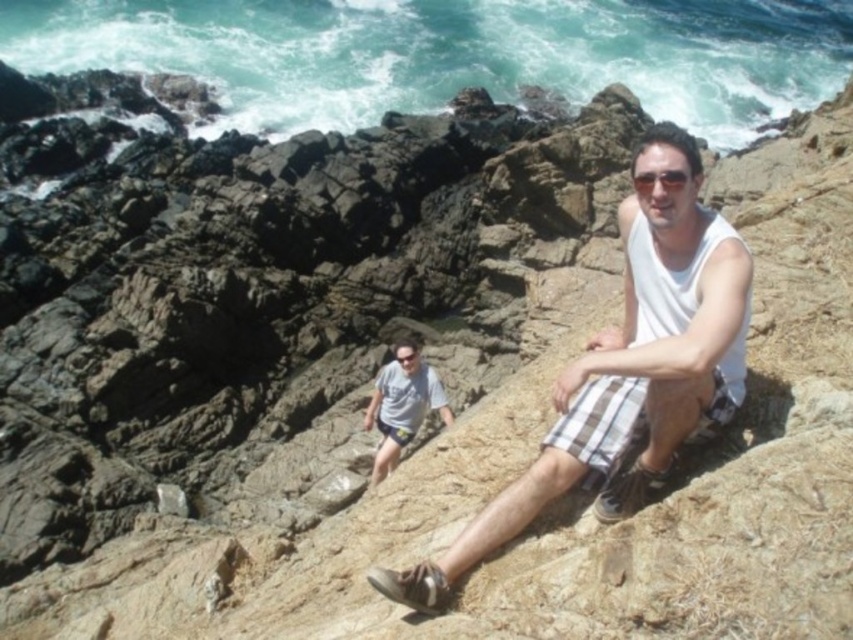
Which of these two, white cotton tank top at center or white cotton shirt at center, stands taller?

With more height is white cotton tank top at center.

This screenshot has height=640, width=853. Describe the element at coordinates (628, 369) in the screenshot. I see `white cotton tank top at center` at that location.

Who is more distant from viewer, (x=518, y=512) or (x=405, y=372)?

Positioned behind is point (x=405, y=372).

Where is `white cotton tank top at center`? The width and height of the screenshot is (853, 640). white cotton tank top at center is located at coordinates (628, 369).